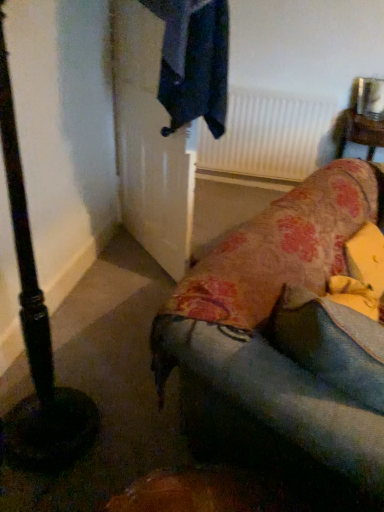
This screenshot has width=384, height=512. I want to click on free space above white matte radiator at upper center (from a real-world perspective), so click(279, 89).